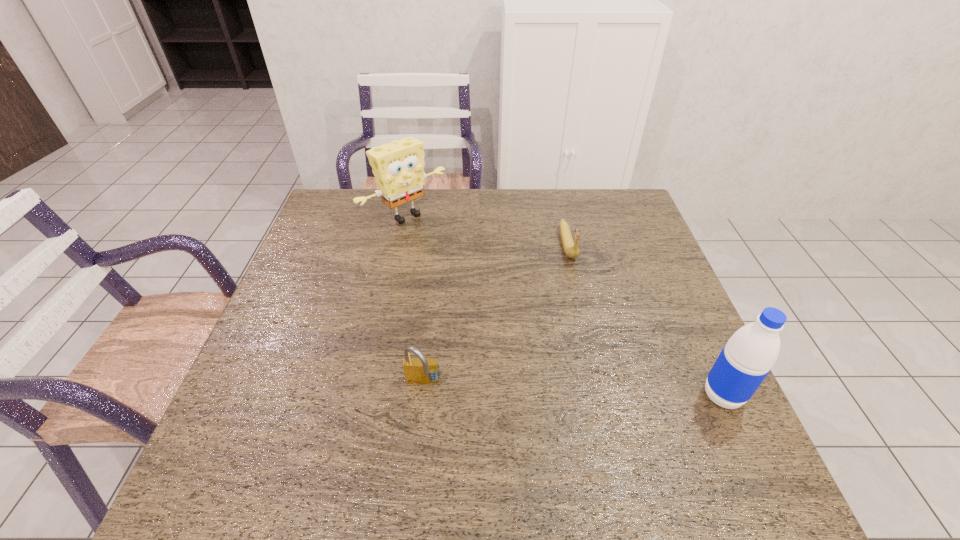
Locate an element on the screen. free spot that satisfies the following two spatial constraints: 1. on the side with the combination dials of the padlock; 2. on the right side of the water bottle is located at coordinates (422, 395).